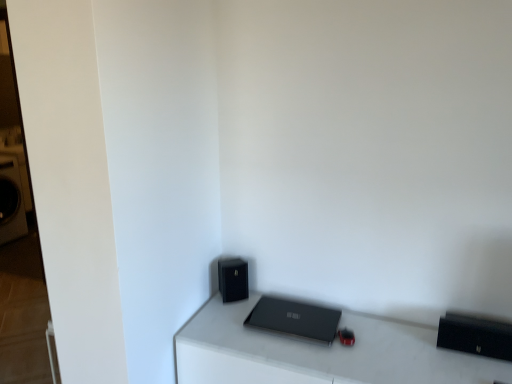
Question: Is matte black laptop at center positioned far away from black matte speaker at lower center?

Choices:
 (A) yes
 (B) no

Answer: (B)

Question: Does matte black laptop at center touch black matte speaker at lower center?

Choices:
 (A) no
 (B) yes

Answer: (A)

Question: Can you confirm if matte black laptop at center is smaller than black matte speaker at lower center?

Choices:
 (A) yes
 (B) no

Answer: (A)

Question: Considering the relative sizes of matte black laptop at center and black matte speaker at lower center in the image provided, is matte black laptop at center wider than black matte speaker at lower center?

Choices:
 (A) no
 (B) yes

Answer: (B)

Question: From a real-world perspective, is matte black laptop at center positioned under black matte speaker at lower center based on gravity?

Choices:
 (A) yes
 (B) no

Answer: (A)

Question: From the image's perspective, relative to matte black laptop at center, is black matte speaker at lower center above or below?

Choices:
 (A) below
 (B) above

Answer: (B)

Question: Is black matte speaker at lower center to the left or to the right of matte black laptop at center in the image?

Choices:
 (A) left
 (B) right

Answer: (A)

Question: Based on their sizes in the image, would you say black matte speaker at lower center is bigger or smaller than matte black laptop at center?

Choices:
 (A) big
 (B) small

Answer: (B)

Question: Is black matte speaker at lower center inside or outside of matte black laptop at center?

Choices:
 (A) outside
 (B) inside

Answer: (A)

Question: Is matte black laptop at center bigger or smaller than matte black laptop at center?

Choices:
 (A) big
 (B) small

Answer: (A)

Question: Would you say matte black laptop at center is inside or outside matte black laptop at center?

Choices:
 (A) outside
 (B) inside

Answer: (A)

Question: Visually, is matte black laptop at center positioned to the left or to the right of matte black laptop at center?

Choices:
 (A) right
 (B) left

Answer: (A)

Question: From a real-world perspective, is matte black laptop at center positioned above or below matte black laptop at center?

Choices:
 (A) below
 (B) above

Answer: (A)

Question: Considering their positions, is black matte speaker at lower center located in front of or behind matte black laptop at center?

Choices:
 (A) front
 (B) behind

Answer: (B)

Question: Is black matte speaker at lower center to the left or to the right of matte black laptop at center in the image?

Choices:
 (A) left
 (B) right

Answer: (A)